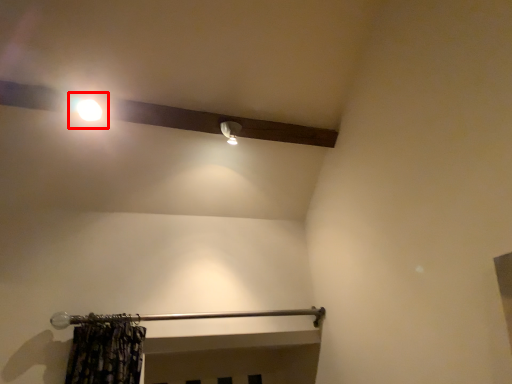
Question: From the image's perspective, where is moonlight (annotated by the red box) located in relation to rail in the image?

Choices:
 (A) above
 (B) below

Answer: (A)